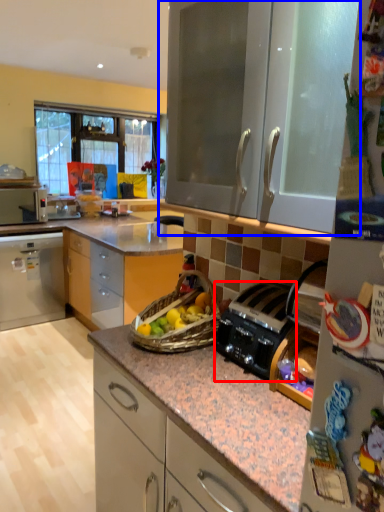
Question: Which object is further to the camera taking this photo, kitchen appliance (highlighted by a red box) or cabinetry (highlighted by a blue box)?

Choices:
 (A) kitchen appliance
 (B) cabinetry

Answer: (A)